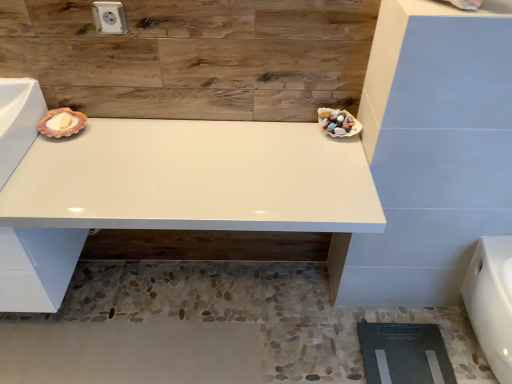
Question: Considering the positions of point (494, 258) and point (315, 193), is point (494, 258) closer or farther from the camera than point (315, 193)?

Choices:
 (A) closer
 (B) farther

Answer: (B)

Question: Is white glossy porcelain at lower right situated inside white glossy vanity at center or outside?

Choices:
 (A) inside
 (B) outside

Answer: (B)

Question: Which of these objects is positioned farthest from the white plastic electric outlet at upper center?

Choices:
 (A) white glossy vanity at center
 (B) white glossy porcelain at lower right

Answer: (B)

Question: Estimate the real-world distances between objects in this image. Which object is closer to the white glossy porcelain at lower right?

Choices:
 (A) white glossy vanity at center
 (B) white plastic electric outlet at upper center

Answer: (A)